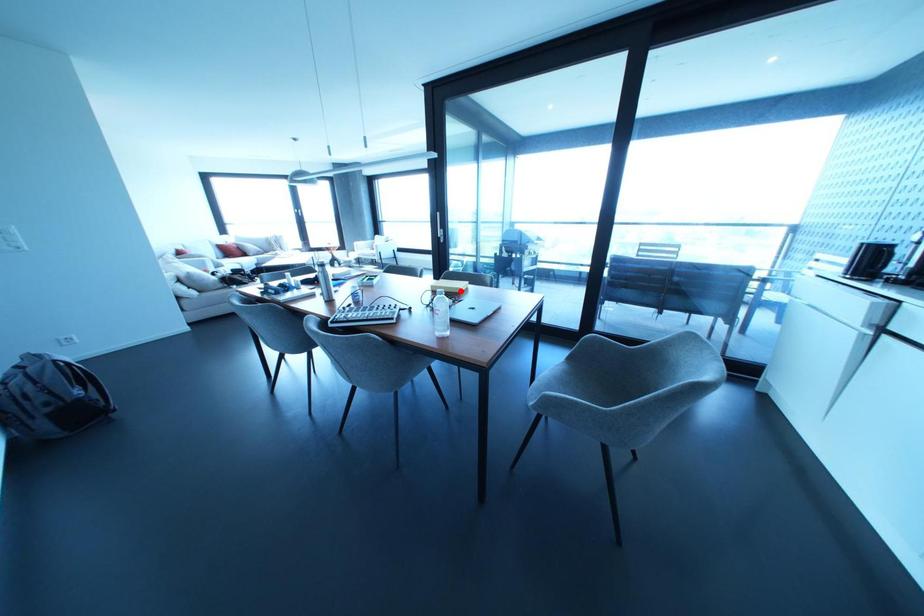
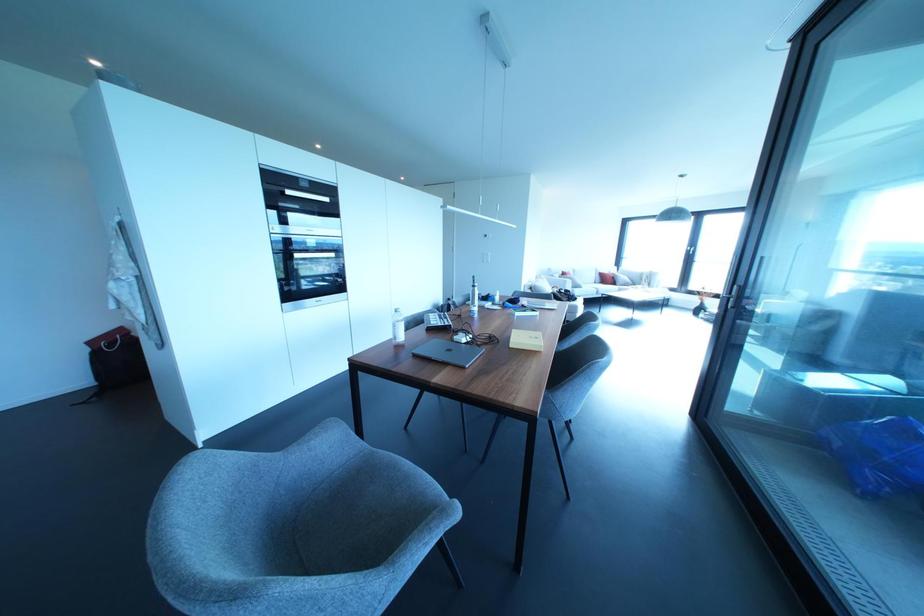
Where in the second image is the point corresponding to the highlighted location from the first image?

(511, 345)